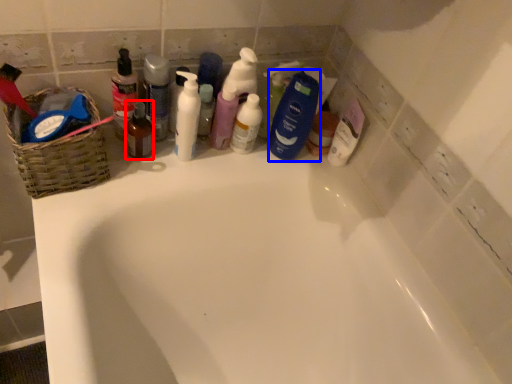
Question: Which point is further to the camera, mouthwash (highlighted by a red box) or cleaning product (highlighted by a blue box)?

Choices:
 (A) mouthwash
 (B) cleaning product

Answer: (B)